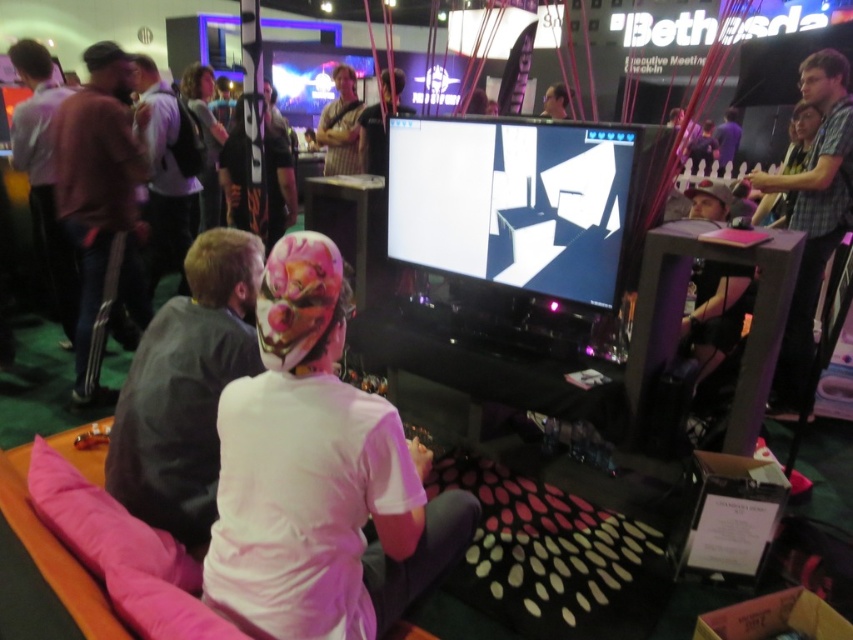
Question: Can you confirm if brown leather jacket at left is bigger than light brown backpack at center-left?

Choices:
 (A) no
 (B) yes

Answer: (A)

Question: Is plaid shirt at right further to the viewer compared to light brown backpack at center-left?

Choices:
 (A) no
 (B) yes

Answer: (A)

Question: Is brown leather jacket at left to the left of light brown leather jacket at left from the viewer's perspective?

Choices:
 (A) yes
 (B) no

Answer: (B)

Question: Estimate the real-world distances between objects in this image. Which object is farther from the white matte shirt at center?

Choices:
 (A) plaid shirt at right
 (B) brown leather jacket at left

Answer: (A)

Question: Which point is closer to the camera taking this photo?

Choices:
 (A) [90, 58]
 (B) [157, 138]

Answer: (A)

Question: Among these points, which one is farthest from the camera?

Choices:
 (A) (82, 100)
 (B) (170, 240)
 (C) (144, 342)

Answer: (B)